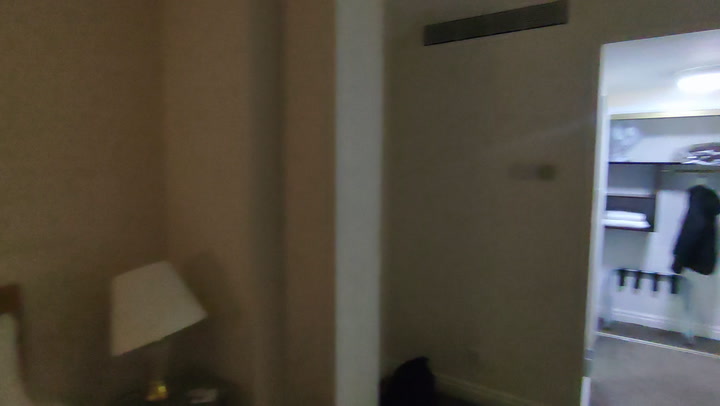
This screenshot has height=406, width=720. I want to click on shelves, so click(667, 116), click(666, 162), click(644, 197), click(646, 230).